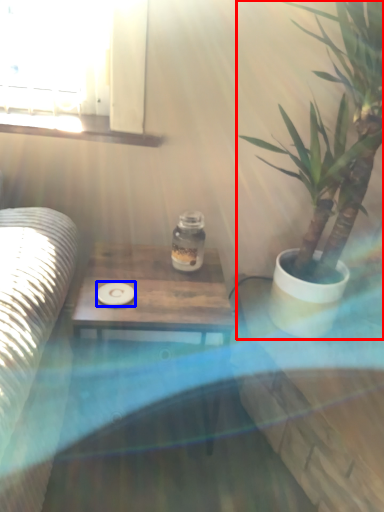
Question: Which point is further to the camera, houseplant (highlighted by a red box) or coaster (highlighted by a blue box)?

Choices:
 (A) houseplant
 (B) coaster

Answer: (B)